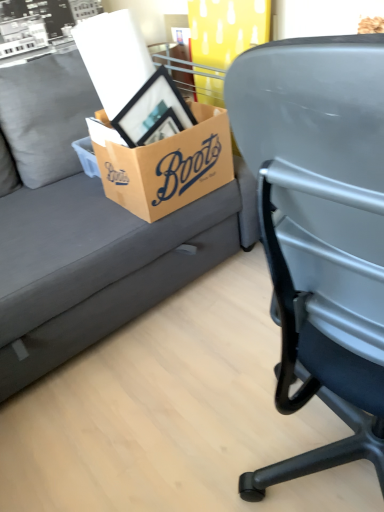
Question: Is brown cardboard box at center shorter than matte gray couch at upper left?

Choices:
 (A) yes
 (B) no

Answer: (A)

Question: Is brown cardboard box at center taller than matte gray couch at upper left?

Choices:
 (A) no
 (B) yes

Answer: (A)

Question: Is brown cardboard box at center positioned behind matte gray couch at upper left?

Choices:
 (A) no
 (B) yes

Answer: (B)

Question: Can you confirm if brown cardboard box at center is thinner than matte gray couch at upper left?

Choices:
 (A) yes
 (B) no

Answer: (A)

Question: From a real-world perspective, is brown cardboard box at center below matte gray couch at upper left?

Choices:
 (A) no
 (B) yes

Answer: (A)

Question: Is brown cardboard box at center not within matte gray couch at upper left?

Choices:
 (A) no
 (B) yes

Answer: (A)

Question: Are matte gray couch at upper left and brown cardboard box at center located far from each other?

Choices:
 (A) yes
 (B) no

Answer: (B)

Question: Is matte gray couch at upper left wider than brown cardboard box at center?

Choices:
 (A) no
 (B) yes

Answer: (B)

Question: Is matte gray couch at upper left bigger than brown cardboard box at center?

Choices:
 (A) no
 (B) yes

Answer: (B)

Question: Is the depth of matte gray couch at upper left less than that of brown cardboard box at center?

Choices:
 (A) yes
 (B) no

Answer: (A)

Question: Is matte gray couch at upper left oriented away from brown cardboard box at center?

Choices:
 (A) yes
 (B) no

Answer: (A)

Question: Is matte gray couch at upper left at the right side of brown cardboard box at center?

Choices:
 (A) yes
 (B) no

Answer: (B)

Question: In the image, is brown cardboard box at center positioned in front of or behind matte gray couch at upper left?

Choices:
 (A) front
 (B) behind

Answer: (B)